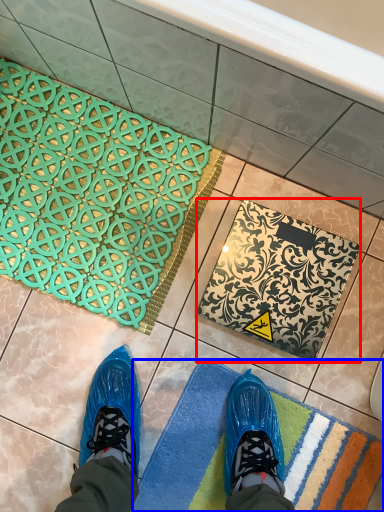
Question: Which point is further to the camera, bath mat (highlighted by a red box) or bath mat (highlighted by a blue box)?

Choices:
 (A) bath mat
 (B) bath mat

Answer: (A)